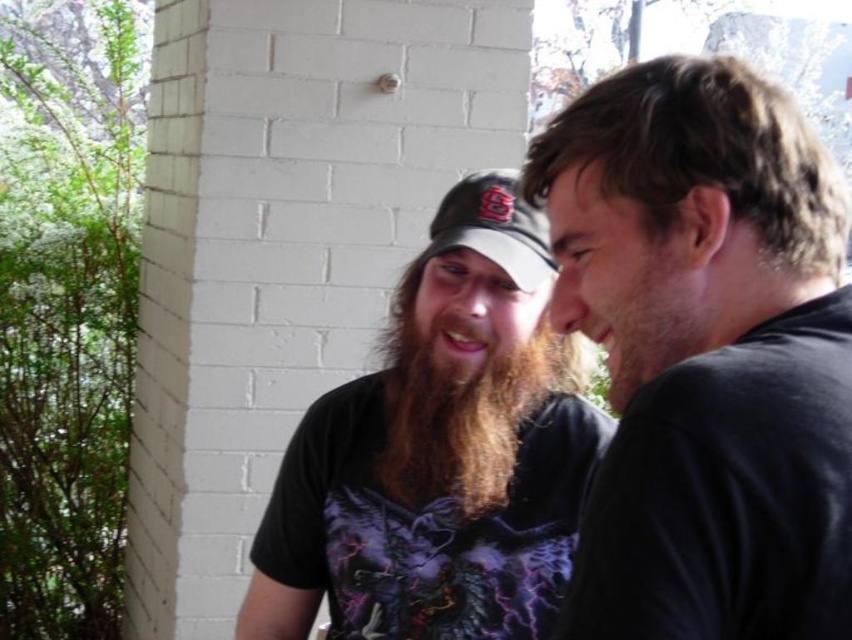
Is point (757, 172) in front of point (533, 300)?

Yes.

Does curly brown hair at right lie behind brown fuzzy beard at center?

No, curly brown hair at right is closer to the viewer.

Between point (715, 168) and point (501, 390), which one is positioned in front?

Point (715, 168) is more forward.

This screenshot has height=640, width=852. I want to click on curly brown hair at right, so click(x=703, y=154).

Who is more forward, (763, 198) or (501, 234)?

Point (763, 198) is more forward.

What do you see at coordinates (706, 353) in the screenshot? I see `dark brown hair at upper right` at bounding box center [706, 353].

Who is more distant from viewer, (758, 452) or (490, 228)?

Point (490, 228)

The image size is (852, 640). Find the location of `dark brown hair at upper right`. dark brown hair at upper right is located at coordinates (706, 353).

Does brown fuzzy beard at center have a greater width compared to brown matte beard at right?

Yes.

Identify the location of brown fuzzy beard at center. This screenshot has height=640, width=852. (465, 378).